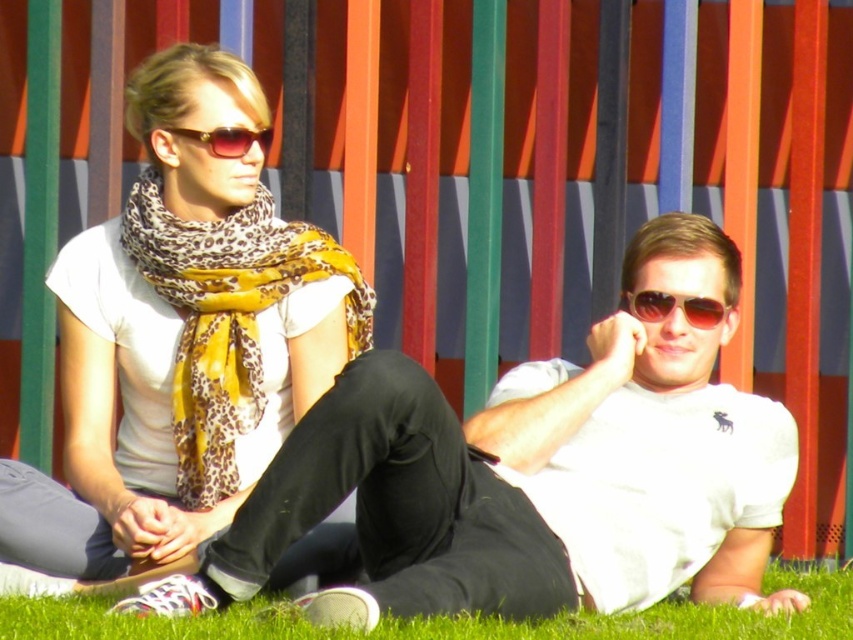
Between white matte shirt at center and sunglasses at upper center, which one is positioned lower?

white matte shirt at center is lower down.

Does white matte shirt at center have a greater height compared to sunglasses at upper center?

Yes, white matte shirt at center is taller than sunglasses at upper center.

Between point (367, 470) and point (233, 141), which one is positioned behind?

The point (233, 141) is behind.

At what (x,y) coordinates should I click in order to perform the action: click on white matte shirt at center. Please return your answer as a coordinate pair (x, y). This screenshot has width=853, height=640. Looking at the image, I should click on (535, 474).

Where is `white matte shirt at center`? This screenshot has height=640, width=853. white matte shirt at center is located at coordinates (535, 474).

Which is behind, point (451, 589) or point (326, 560)?

The point (326, 560) is more distant.

Find the location of `white matte shirt at center`. white matte shirt at center is located at coordinates pyautogui.click(x=535, y=474).

Can you confirm if leopard print scarf at upper left is shorter than sunglasses at upper center?

No, leopard print scarf at upper left is not shorter than sunglasses at upper center.

Which is behind, point (100, 237) or point (222, 140)?

Point (100, 237)

This screenshot has width=853, height=640. Find the location of `leopard print scarf at upper left`. leopard print scarf at upper left is located at coordinates (178, 342).